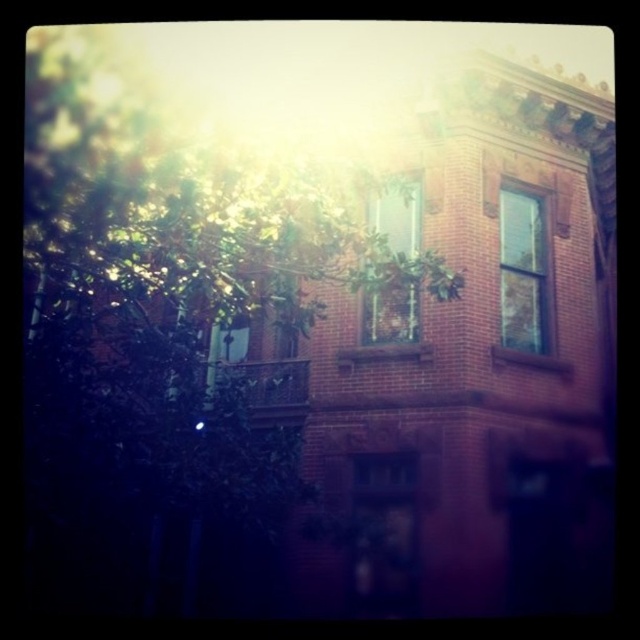
Is green leafy tree at upper left above clear glass window at center?

No, green leafy tree at upper left is not above clear glass window at center.

Can you confirm if green leafy tree at upper left is positioned to the right of clear glass window at center?

No, green leafy tree at upper left is not to the right of clear glass window at center.

Image resolution: width=640 pixels, height=640 pixels. Describe the element at coordinates (157, 324) in the screenshot. I see `green leafy tree at upper left` at that location.

Identify the location of green leafy tree at upper left. (157, 324).

Between green leafy tree at upper left and clear glass window at upper right, which one has less height?

Standing shorter between the two is green leafy tree at upper left.

Where is `green leafy tree at upper left`? Image resolution: width=640 pixels, height=640 pixels. green leafy tree at upper left is located at coordinates (157, 324).

Is point (540, 234) more distant than point (368, 342)?

That is True.

Does clear glass window at upper right appear on the left side of clear glass window at center?

In fact, clear glass window at upper right is to the right of clear glass window at center.

Locate an element on the screen. clear glass window at upper right is located at coordinates (524, 272).